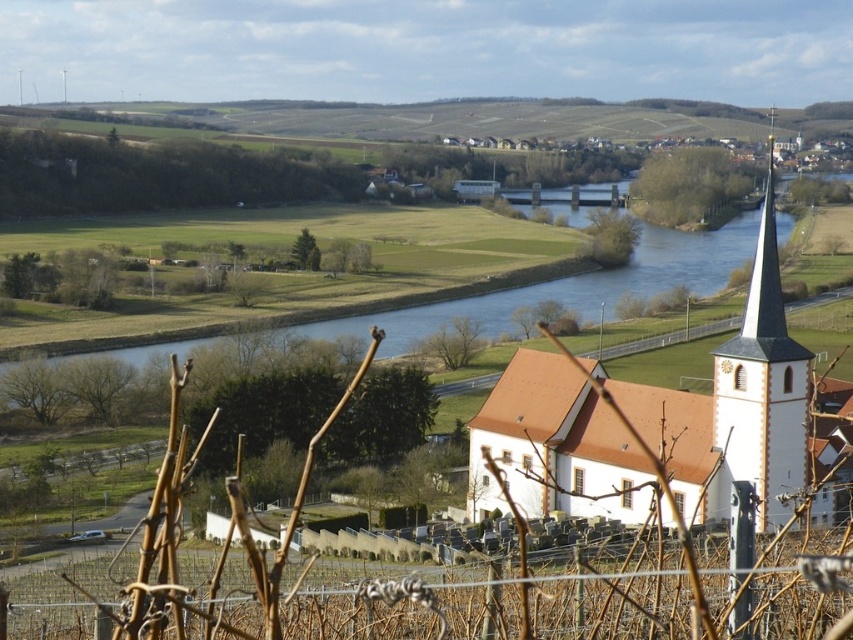
Based on the photo, is white matte church at center to the right of blue water at center from the viewer's perspective?

Indeed, white matte church at center is positioned on the right side of blue water at center.

Measure the distance from white matte church at center to blue water at center.

white matte church at center and blue water at center are 189.69 feet apart from each other.

From the picture: Who is more forward, [689,520] or [596,298]?

Point [689,520] is more forward.

You are a GUI agent. You are given a task and a screenshot of the screen. Output one action in this format:
    pyautogui.click(x=<x>, y=<y>)
    Task: Click on the white matte church at center
    
    Given the screenshot: What is the action you would take?
    pyautogui.click(x=653, y=422)

Can you confirm if white matte church at center is bigger than white stucco tower at right?

No, white matte church at center is not bigger than white stucco tower at right.

Does white matte church at center have a lesser height compared to white stucco tower at right?

Yes, white matte church at center is shorter than white stucco tower at right.

Image resolution: width=853 pixels, height=640 pixels. What do you see at coordinates (653, 422) in the screenshot?
I see `white matte church at center` at bounding box center [653, 422].

At what (x,y) coordinates should I click in order to perform the action: click on white matte church at center. Please return your answer as a coordinate pair (x, y). The height and width of the screenshot is (640, 853). Looking at the image, I should click on [653, 422].

Does point (741, 468) come behind point (511, 324)?

No, it is in front of (511, 324).

Who is shorter, white stucco tower at right or blue water at center?

blue water at center

Is point (804, 356) farther from viewer compared to point (643, 262)?

That is False.

Find the location of a particular element. white stucco tower at right is located at coordinates (762, 385).